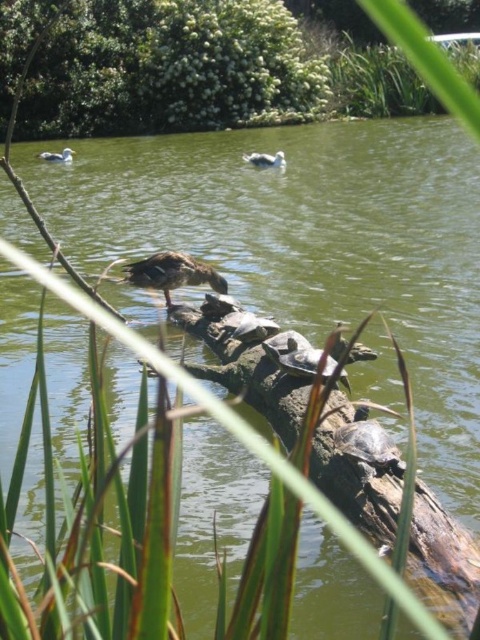
Is point (196, 268) positioned in front of point (51, 154)?

Yes, it is in front of point (51, 154).

Does point (134, 275) come behind point (64, 160)?

No.

You are a GUI agent. You are given a task and a screenshot of the screen. Output one action in this format:
    pyautogui.click(x=<x>, y=<y>)
    Task: Click on the brown matte duck at center
    This screenshot has height=640, width=480.
    Given the screenshot: What is the action you would take?
    pyautogui.click(x=172, y=273)

Can you confirm if white matte duck at upper center is wider than matte gray duck at upper left?

Incorrect, white matte duck at upper center's width does not surpass matte gray duck at upper left's.

Does point (260, 160) come in front of point (62, 157)?

That is True.

Is point (253, 156) positioned after point (47, 157)?

No, (253, 156) is in front of (47, 157).

Locate an element on the screen. white matte duck at upper center is located at coordinates (265, 160).

Does point (232, 1) come in front of point (179, 260)?

No, (232, 1) is behind (179, 260).

Does green leafy bush at upper center appear on the left side of brown matte duck at center?

Yes, green leafy bush at upper center is to the left of brown matte duck at center.

The width and height of the screenshot is (480, 640). What are the coordinates of `green leafy bush at upper center` in the screenshot? It's located at (169, 68).